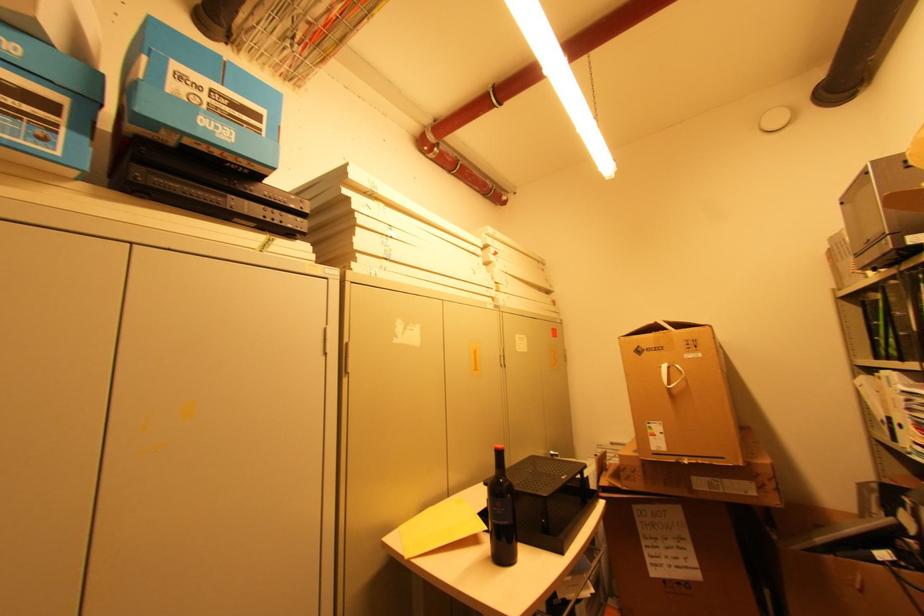
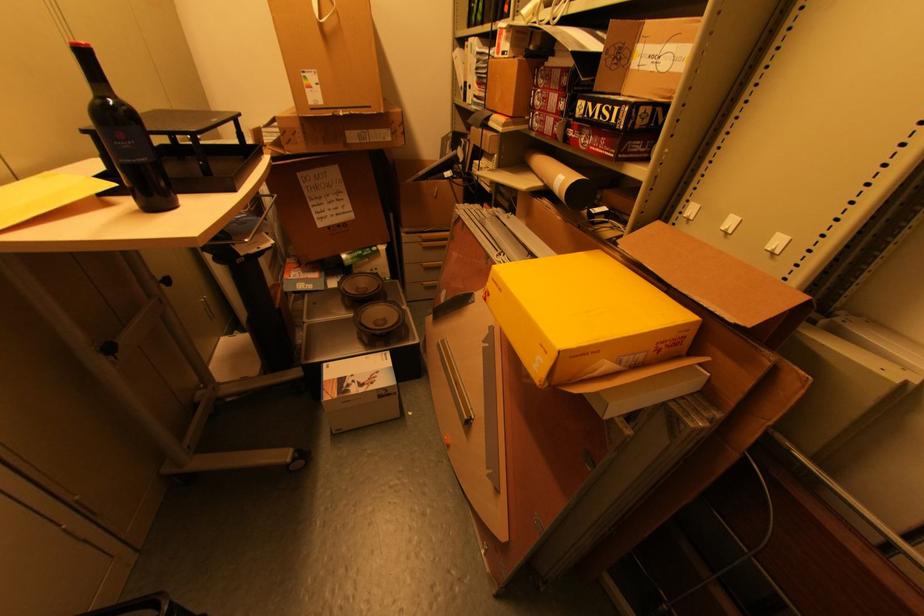
The point at (672,386) is marked in the first image. Where is the corresponding point in the second image?

(323, 18)